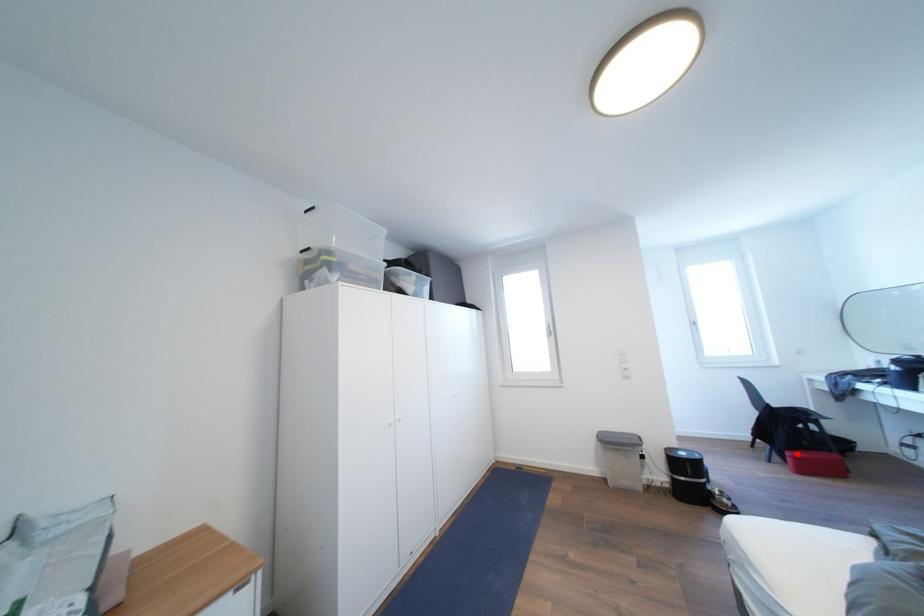
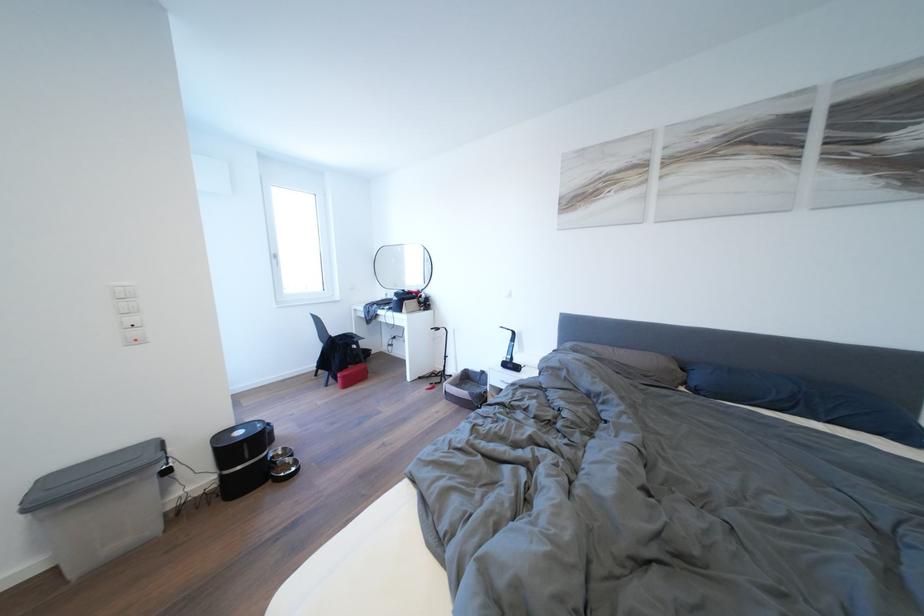
Question: I am providing you with two images of the same scene from different viewpoints. In image1, a red point is highlighted. Considering the same 3D point in image2, which of the following is correct?

Choices:
 (A) It is closer
 (B) It is farther

Answer: (A)